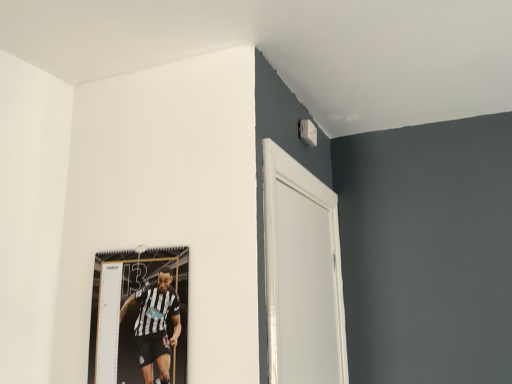
Question: Based on their sizes in the image, would you say white glossy door at upper right is bigger or smaller than black and white jersey at upper left?

Choices:
 (A) big
 (B) small

Answer: (A)

Question: Relative to black and white jersey at upper left, is white glossy door at upper right in front or behind?

Choices:
 (A) front
 (B) behind

Answer: (A)

Question: Considering the positions of white glossy door at upper right and black and white jersey at upper left in the image, is white glossy door at upper right taller or shorter than black and white jersey at upper left?

Choices:
 (A) short
 (B) tall

Answer: (B)

Question: From the image's perspective, relative to white glossy door at upper right, is black and white jersey at upper left above or below?

Choices:
 (A) below
 (B) above

Answer: (A)

Question: From a real-world perspective, is black and white jersey at upper left above or below white glossy door at upper right?

Choices:
 (A) below
 (B) above

Answer: (A)

Question: In the image, is black and white jersey at upper left on the left side or the right side of white glossy door at upper right?

Choices:
 (A) left
 (B) right

Answer: (A)

Question: Is black and white jersey at upper left bigger or smaller than white glossy door at upper right?

Choices:
 (A) small
 (B) big

Answer: (A)